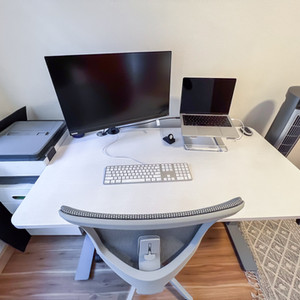
Locate an element on the screen. The width and height of the screenshot is (300, 300). rug is located at coordinates (282, 247).